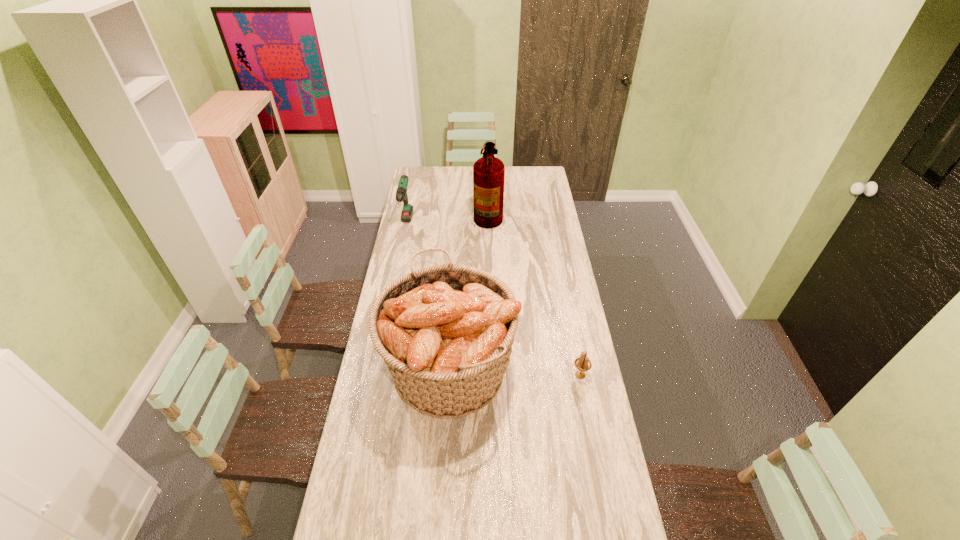
Where is `vacant space situated 0.100m on the handle side of the drill`? The height and width of the screenshot is (540, 960). vacant space situated 0.100m on the handle side of the drill is located at coordinates click(x=400, y=252).

Where is `free space located 0.340m on the back of the candle holder`? The image size is (960, 540). free space located 0.340m on the back of the candle holder is located at coordinates (566, 303).

You are a GUI agent. You are given a task and a screenshot of the screen. Output one action in this format:
    pyautogui.click(x=<x>, y=<y>)
    Task: Click on the basket that is at the left edge
    This screenshot has width=960, height=540.
    Given the screenshot: What is the action you would take?
    point(445,332)

The width and height of the screenshot is (960, 540). I want to click on drill at the left edge, so click(x=401, y=194).

Identify the location of object that is at the right edge. The width and height of the screenshot is (960, 540). (583, 364).

Locate an element on the screen. This screenshot has height=540, width=960. vacant space at the far edge of the desktop is located at coordinates (516, 177).

Locate an element on the screen. The height and width of the screenshot is (540, 960). vacant space at the left edge of the desktop is located at coordinates (365, 481).

In the image, there is a desktop. Where is `vacant space at the right edge`? vacant space at the right edge is located at coordinates (540, 296).

In order to click on vacant space at the far left corner in this screenshot , I will do `click(420, 170)`.

The height and width of the screenshot is (540, 960). In order to click on free space at the far right corner of the desktop in this screenshot , I will do `click(548, 178)`.